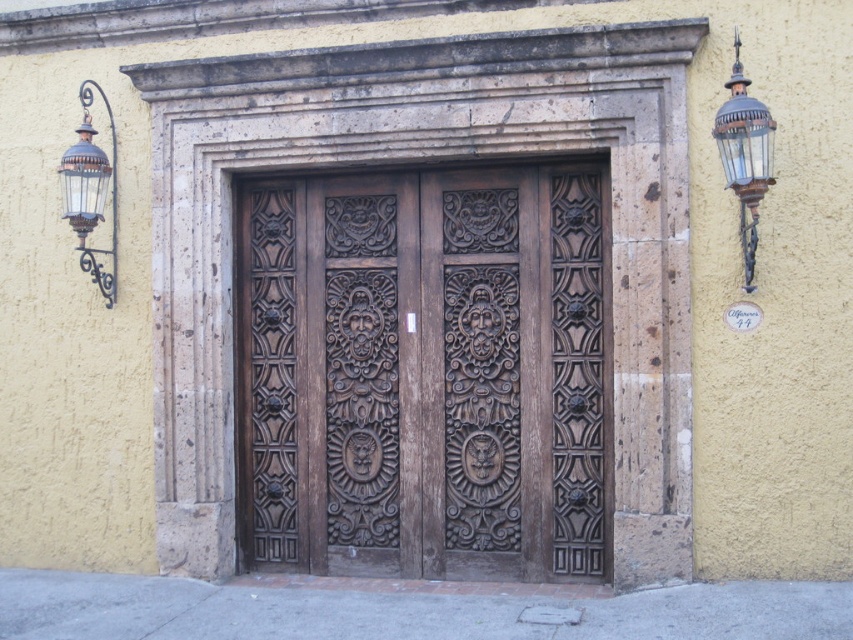
Question: In this image, where is dark brown wood door at center located relative to antique brass lantern at upper right?

Choices:
 (A) left
 (B) right

Answer: (A)

Question: Is dark brown wood door at center bigger than antique brass lantern at upper right?

Choices:
 (A) yes
 (B) no

Answer: (A)

Question: Among these objects, which one is farthest from the camera?

Choices:
 (A) antique brass lantern at upper right
 (B) dark brown wood door at center

Answer: (B)

Question: Can you confirm if dark brown wood door at center is positioned to the left of antique brass lantern at upper right?

Choices:
 (A) no
 (B) yes

Answer: (B)

Question: Which point is closer to the camera?

Choices:
 (A) dark brown wood door at center
 (B) antique brass lantern at upper right

Answer: (B)

Question: Among these points, which one is farthest from the camera?

Choices:
 (A) (112, 179)
 (B) (746, 113)
 (C) (547, 305)

Answer: (A)